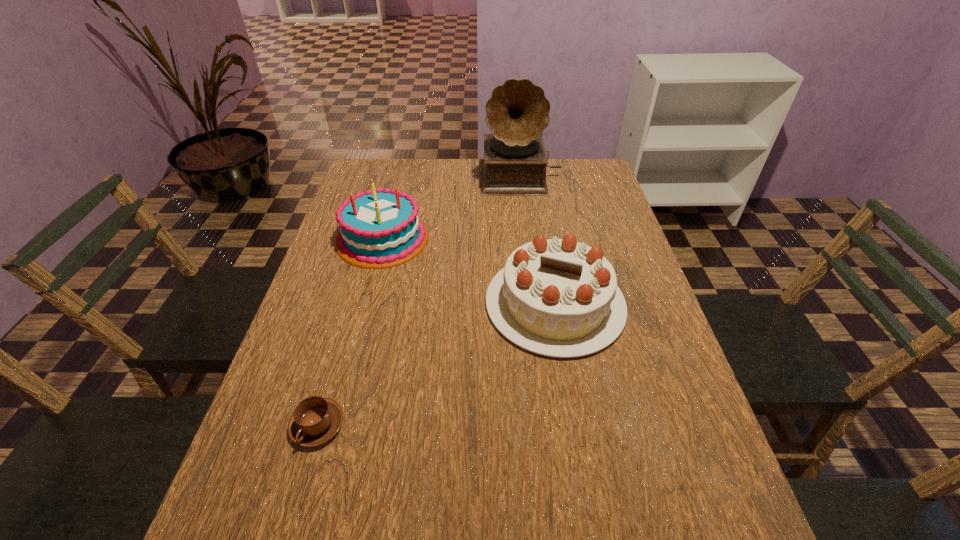
The height and width of the screenshot is (540, 960). Identify the location of record player. (514, 164).

At what (x,y) coordinates should I click in order to perform the action: click on the farthest object. Please return your answer as a coordinate pair (x, y). The width and height of the screenshot is (960, 540). Looking at the image, I should click on (514, 164).

Image resolution: width=960 pixels, height=540 pixels. In order to click on the left birthday cake in this screenshot , I will do `click(381, 228)`.

Where is `the right birthday cake`? the right birthday cake is located at coordinates (558, 297).

Identify the location of the nearest object. (315, 420).

Locate an element on the screen. The image size is (960, 540). the shortest object is located at coordinates (315, 420).

Identify the location of free space located from the horn of the record player. (526, 222).

Identify the location of vacant space located on the back of the left birthday cake. (392, 203).

Find the location of `vacant area located on the back of the right birthday cake`. vacant area located on the back of the right birthday cake is located at coordinates (538, 200).

Find the location of `blank space located 0.100m on the side of the shortest object with the handle`. blank space located 0.100m on the side of the shortest object with the handle is located at coordinates (294, 507).